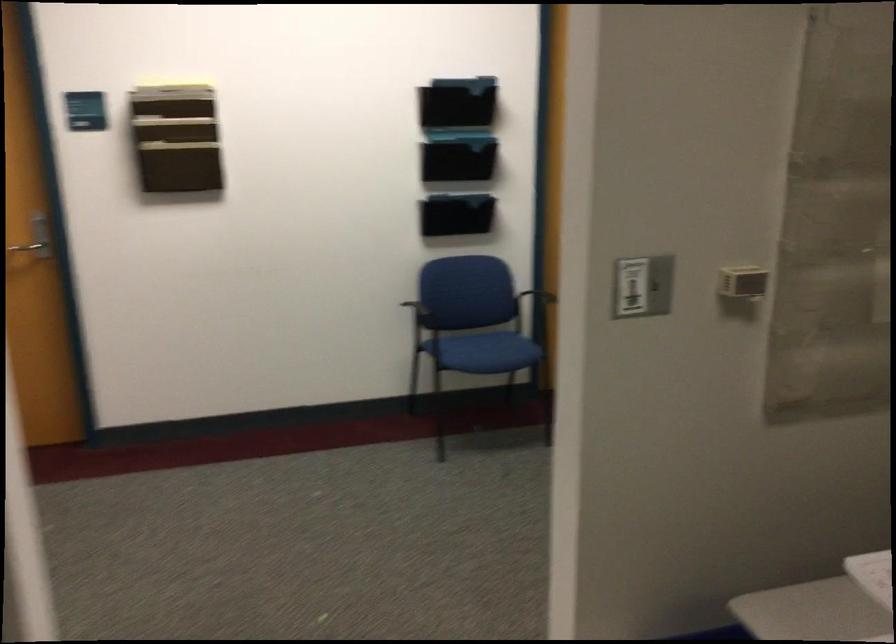
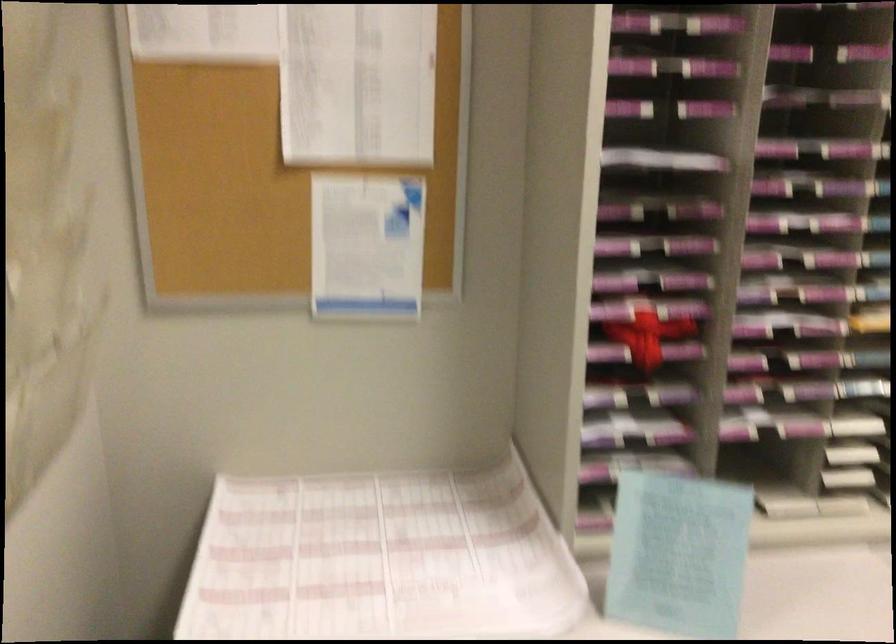
Question: The camera is either moving clockwise (left) or counter-clockwise (right) around the object. The first image is from the beginning of the video and the second image is from the end. Is the camera moving left or right when shooting the video?

Choices:
 (A) Left
 (B) Right

Answer: (A)